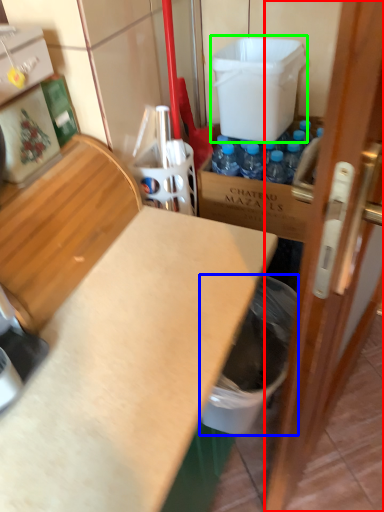
Question: Which object is the farthest from door (highlighted by a red box)? Choose among these: garbage (highlighted by a blue box) or water cooler (highlighted by a green box).

Choices:
 (A) garbage
 (B) water cooler

Answer: (B)